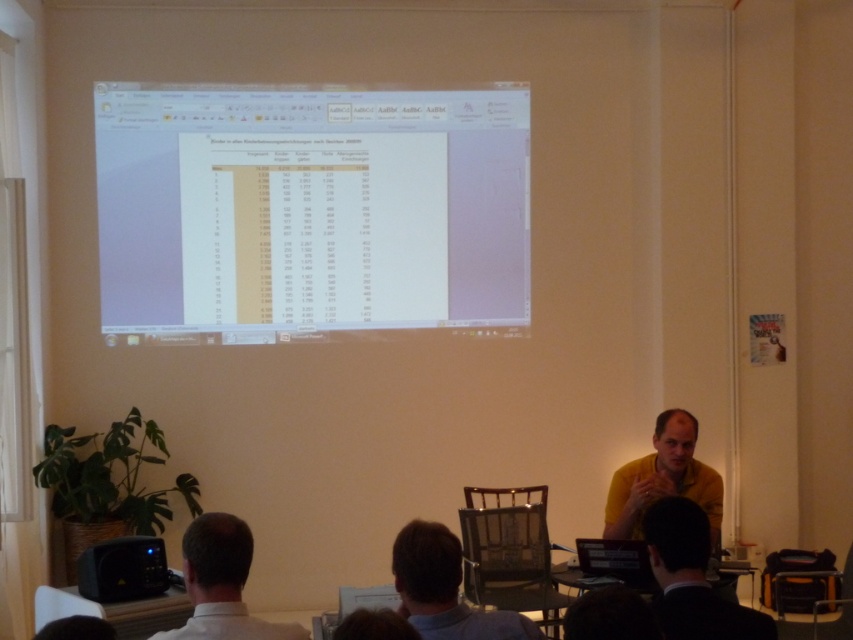
Between point (416, 161) and point (149, 548), which one is positioned in front?

Positioned in front is point (149, 548).

Which is in front, point (258, 180) or point (144, 563)?

Point (144, 563) is in front.

I want to click on white paper at center, so click(310, 211).

Can you confirm if white paper at center is bigger than yellow matte shirt at center?

Yes, white paper at center is bigger than yellow matte shirt at center.

Image resolution: width=853 pixels, height=640 pixels. Find the location of `white paper at center`. white paper at center is located at coordinates click(310, 211).

Where is `white paper at center`? Image resolution: width=853 pixels, height=640 pixels. white paper at center is located at coordinates (310, 211).

From the picture: Which is more to the right, dark suit at lower right or black plastic projector at lower left?

Positioned to the right is dark suit at lower right.

Who is lower down, dark suit at lower right or black plastic projector at lower left?

black plastic projector at lower left is lower down.

Measure the distance between dark suit at lower right and camera.

dark suit at lower right is 6.89 feet from camera.

Where is `dark suit at lower right`? The height and width of the screenshot is (640, 853). dark suit at lower right is located at coordinates (692, 579).